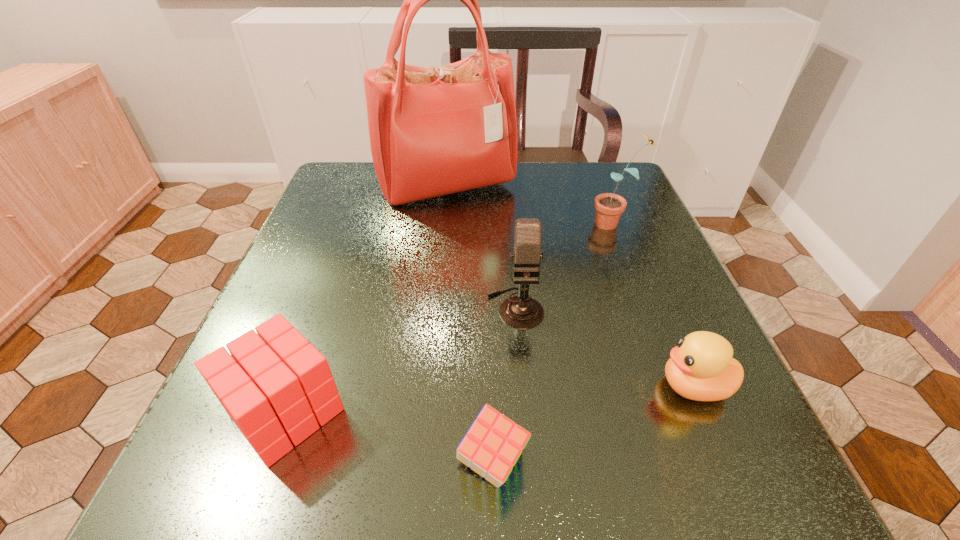
The height and width of the screenshot is (540, 960). In the image, there is a desktop. What are the coordinates of `vacant space at the near right corner` in the screenshot? It's located at (756, 502).

Identify the location of free space between the sunflower and the shortest object. pos(553,343).

The width and height of the screenshot is (960, 540). I want to click on empty space that is in between the microphone and the left cube, so click(401, 359).

Where is `free space between the handbag and the shorter cube`? Image resolution: width=960 pixels, height=540 pixels. free space between the handbag and the shorter cube is located at coordinates (469, 326).

I want to click on vacant area that lies between the shortest object and the third farthest object, so click(504, 386).

Locate an element on the screen. This screenshot has width=960, height=540. free spot between the duckling and the shorter cube is located at coordinates (593, 425).

Locate an element on the screen. free space between the right cube and the fourth nearest object is located at coordinates (504, 386).

The image size is (960, 540). In order to click on vacant space that is in between the shorter cube and the duckling in this screenshot , I will do `click(593, 425)`.

You are a GUI agent. You are given a task and a screenshot of the screen. Output one action in this format:
    pyautogui.click(x=<x>, y=<y>)
    Task: Click on the unoccupied area between the left cube and the duckling
    
    Given the screenshot: What is the action you would take?
    pyautogui.click(x=491, y=399)

Locate an element on the screen. free space that is in between the sunflower and the fourth nearest object is located at coordinates (565, 265).